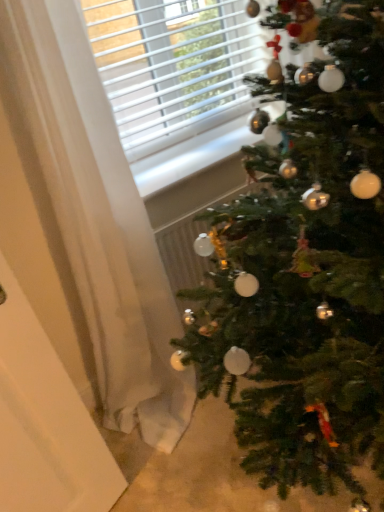
Question: Considering the positions of green matte christmas tree at right and white sheer curtain at left in the image, is green matte christmas tree at right wider or thinner than white sheer curtain at left?

Choices:
 (A) thin
 (B) wide

Answer: (B)

Question: Is green matte christmas tree at right inside the boundaries of white sheer curtain at left, or outside?

Choices:
 (A) outside
 (B) inside

Answer: (A)

Question: Based on their relative distances, which object is nearer to the white sheer curtain at left?

Choices:
 (A) green matte christmas tree at right
 (B) white matte screen door at left

Answer: (B)

Question: Estimate the real-world distances between objects in this image. Which object is closer to the white matte screen door at left?

Choices:
 (A) white sheer curtain at left
 (B) green matte christmas tree at right

Answer: (A)